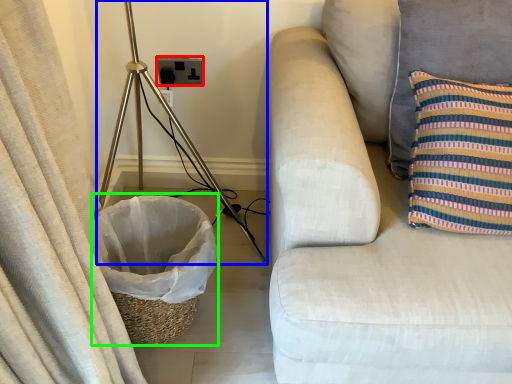
Question: Which object is positioned closest to electric outlet (highlighted by a red box)? Select from tripod (highlighted by a blue box) and laundry basket (highlighted by a green box).

Choices:
 (A) tripod
 (B) laundry basket

Answer: (A)